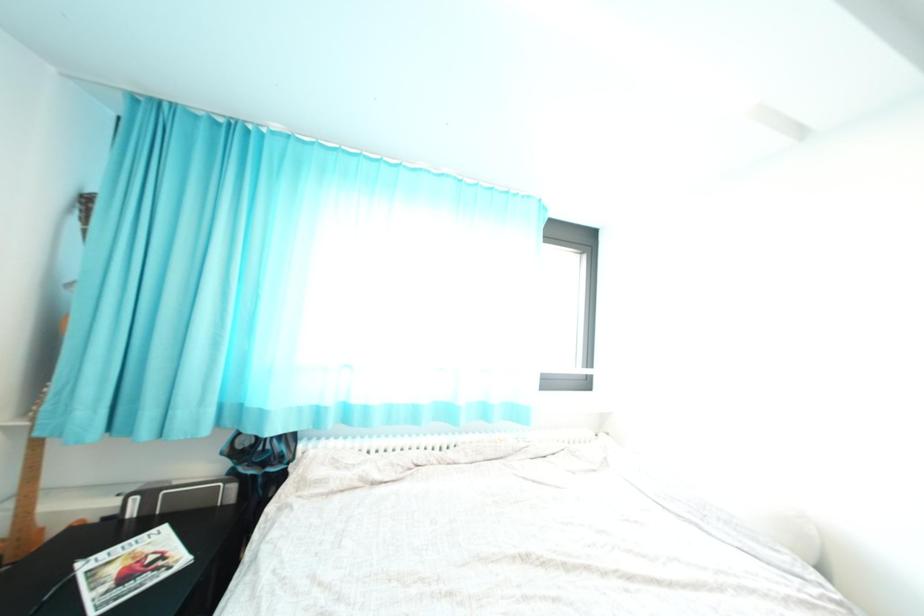
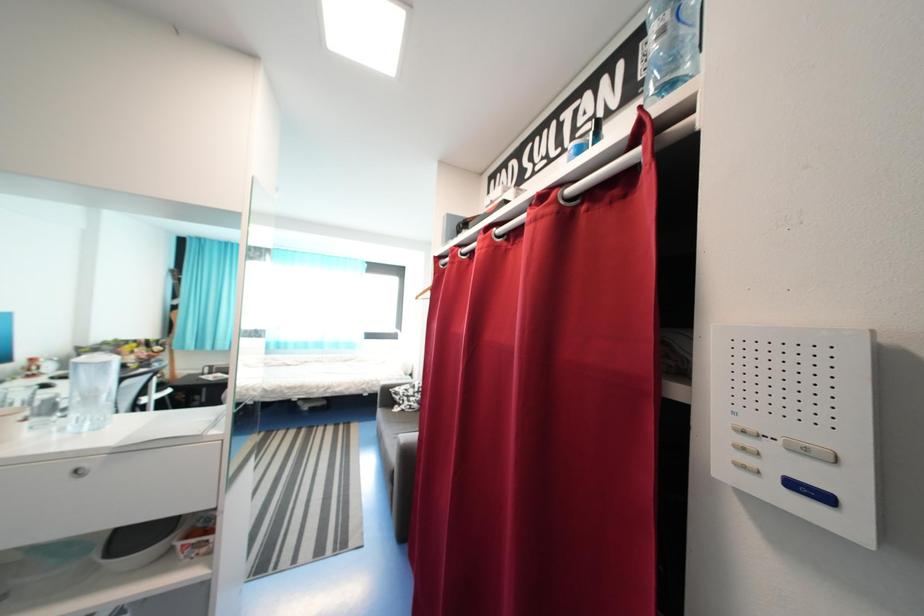
What movement of the cameraman would produce the second image?

The cameraman moved toward right, backward.